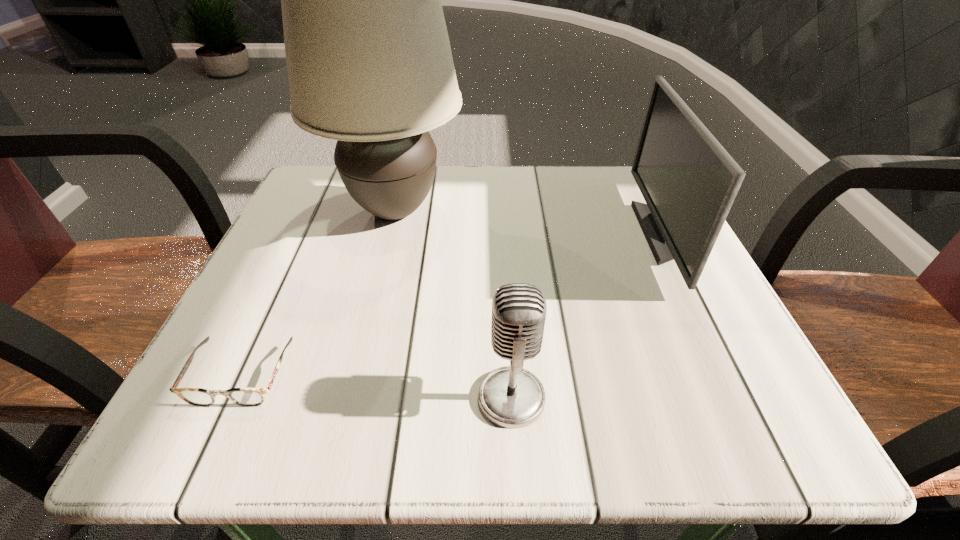
Where is `vacant space located 0.070m on the back of the microphone`? This screenshot has width=960, height=540. vacant space located 0.070m on the back of the microphone is located at coordinates (508, 332).

Identify the location of lampshade situated at the far edge. This screenshot has height=540, width=960. (369, 62).

This screenshot has height=540, width=960. In order to click on monitor at the far edge in this screenshot , I will do `click(689, 182)`.

Identify the location of microphone located at the near edge. (512, 397).

In order to click on spectacles present at the near edge in this screenshot , I will do (x=248, y=397).

The height and width of the screenshot is (540, 960). Find the location of `lampshade present at the left edge`. lampshade present at the left edge is located at coordinates (369, 62).

Identify the location of spectacles present at the left edge. (248, 397).

Locate an element on the screen. The image size is (960, 540). object that is at the right edge is located at coordinates (689, 182).

The height and width of the screenshot is (540, 960). Identify the location of object positioned at the far left corner. (369, 62).

Locate an element on the screen. The height and width of the screenshot is (540, 960). object located in the near left corner section of the desktop is located at coordinates (248, 397).